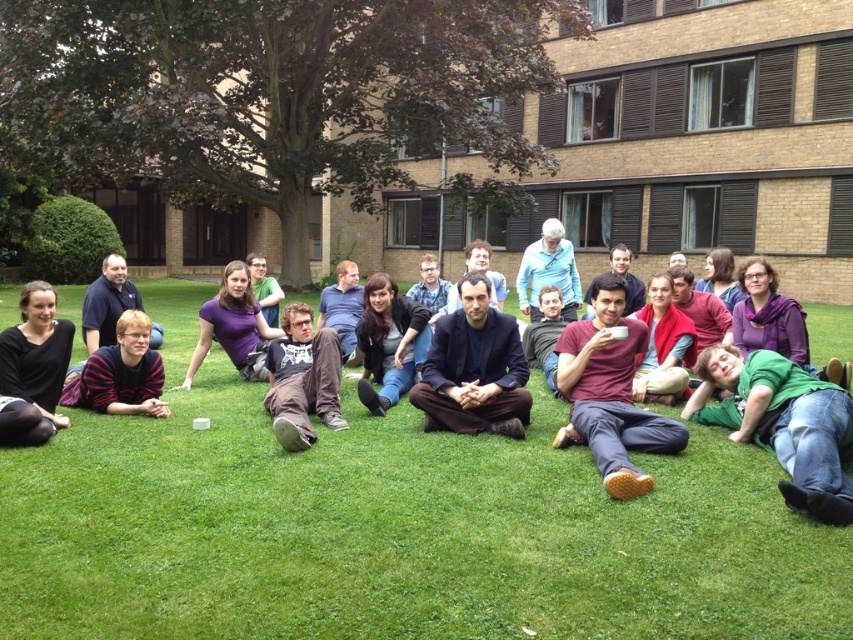
Can you confirm if green grass at lower center is shorter than maroon fabric shirt at center?

Incorrect, green grass at lower center's height does not fall short of maroon fabric shirt at center's.

Looking at this image, does green grass at lower center appear on the right side of maroon fabric shirt at center?

No, green grass at lower center is not to the right of maroon fabric shirt at center.

At what (x,y) coordinates should I click in order to perform the action: click on green grass at lower center. Please return your answer as a coordinate pair (x, y). The height and width of the screenshot is (640, 853). Looking at the image, I should click on (397, 532).

Is green cotton shirt at lower right below black matte shirt at lower left?

Correct, green cotton shirt at lower right is located below black matte shirt at lower left.

Can you confirm if green cotton shirt at lower right is bigger than black matte shirt at lower left?

Yes, green cotton shirt at lower right is bigger than black matte shirt at lower left.

The height and width of the screenshot is (640, 853). Describe the element at coordinates (782, 422) in the screenshot. I see `green cotton shirt at lower right` at that location.

Image resolution: width=853 pixels, height=640 pixels. What are the coordinates of `green cotton shirt at lower right` in the screenshot? It's located at pos(782,422).

Can you confirm if black matte shirt at lower left is bigger than brown cotton pants at center?

Incorrect, black matte shirt at lower left is not larger than brown cotton pants at center.

Is point (33, 388) farther from viewer compared to point (294, 429)?

Yes, it is behind point (294, 429).

Image resolution: width=853 pixels, height=640 pixels. I want to click on black matte shirt at lower left, so click(33, 369).